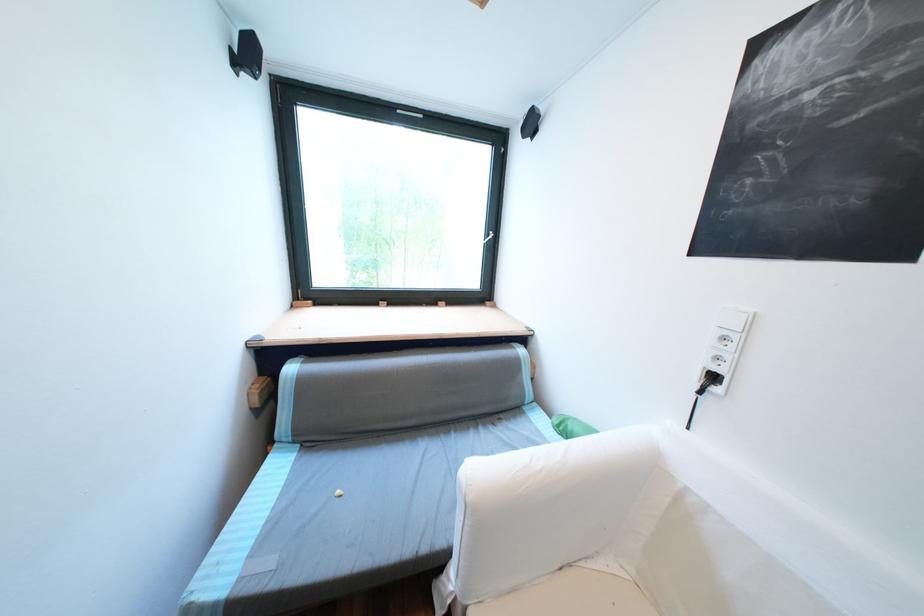
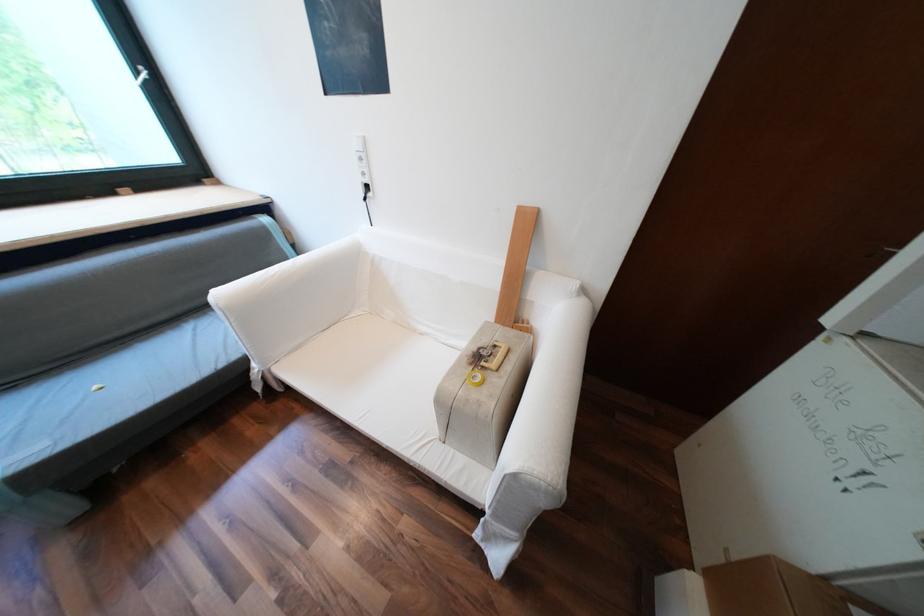
Find the pixel in the second image that matches point (723, 378) in the first image.

(377, 187)